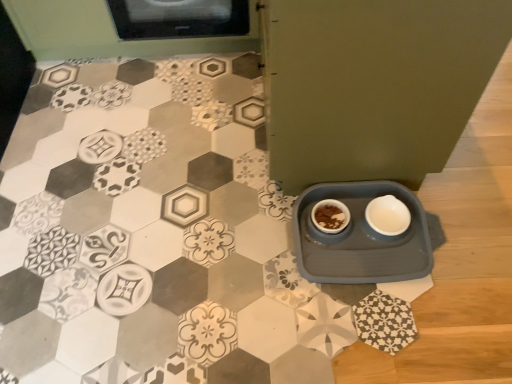
Locate an element on the screen. vacant area to the right of gray plastic tray at lower right is located at coordinates (472, 225).